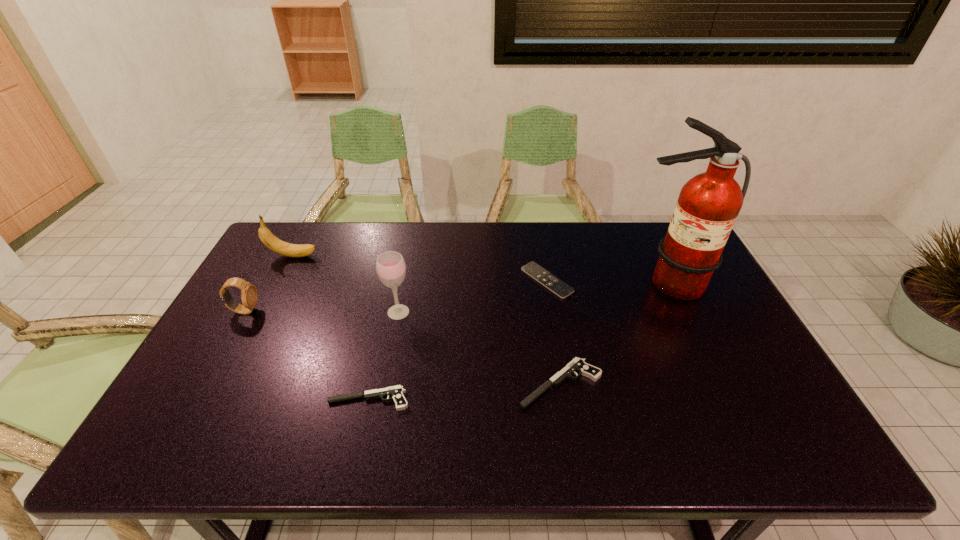
What are the coordinates of `vacant area between the watch and the taller pistol` in the screenshot? It's located at (402, 347).

Where is `free point between the wineglass and the taller pistol`? The width and height of the screenshot is (960, 540). free point between the wineglass and the taller pistol is located at coordinates (479, 348).

Where is `the third closest object to the farthest object`? The image size is (960, 540). the third closest object to the farthest object is located at coordinates (396, 392).

Locate which object ranks in proximity to the wineglass. Please provide its 2D coordinates. Your answer should be formatted as a tuple, i.e. [(x, y)], where the tuple contains the x and y coordinates of a point satisfying the conditions above.

[(396, 392)]

The width and height of the screenshot is (960, 540). Find the location of `vacant point that satisfies the following two spatial constraints: 1. at the start of the peel on the farthest object; 2. on the right side of the wineglass`. vacant point that satisfies the following two spatial constraints: 1. at the start of the peel on the farthest object; 2. on the right side of the wineglass is located at coordinates (265, 312).

Where is `blank area in the image that satisfies the following two spatial constraints: 1. on the nozzle and handle of the fire extinguisher; 2. on the front-facing side of the left pistol`? This screenshot has width=960, height=540. blank area in the image that satisfies the following two spatial constraints: 1. on the nozzle and handle of the fire extinguisher; 2. on the front-facing side of the left pistol is located at coordinates (723, 399).

The image size is (960, 540). In order to click on free space that satisfies the following two spatial constraints: 1. on the nozzle and handle of the rightmost object; 2. on the face of the watch in this screenshot , I will do `click(681, 310)`.